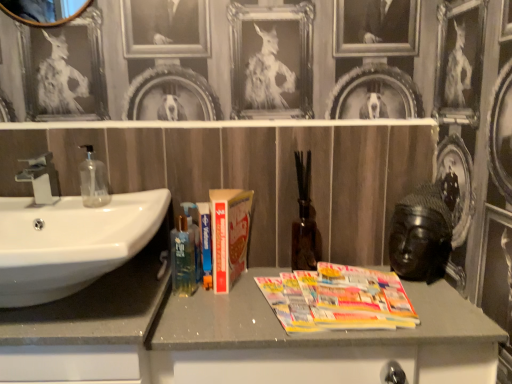
Locate an element on the screen. Image resolution: width=512 pixels, height=384 pixels. empty space that is ontop of matte gray cabinet at center (from a real-world perspective) is located at coordinates (305, 304).